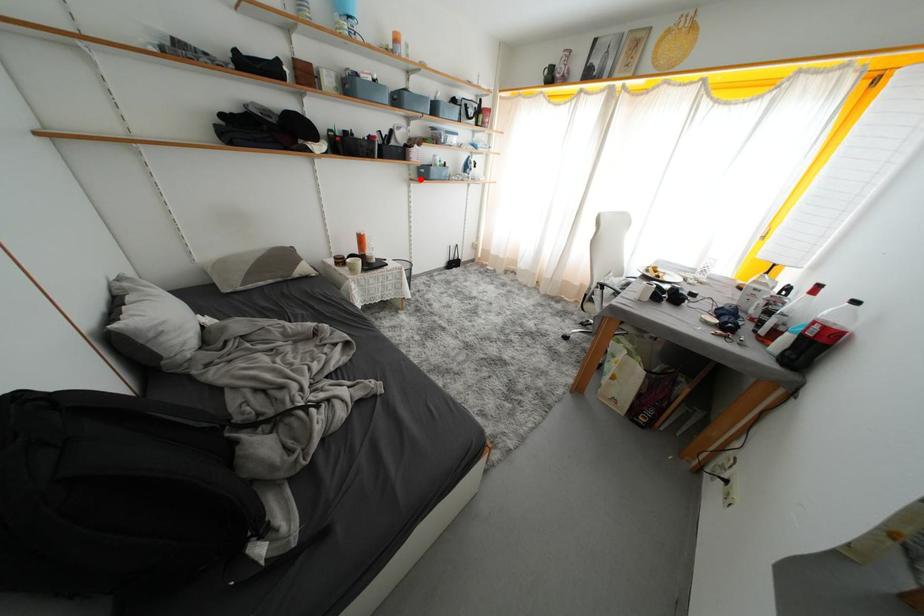
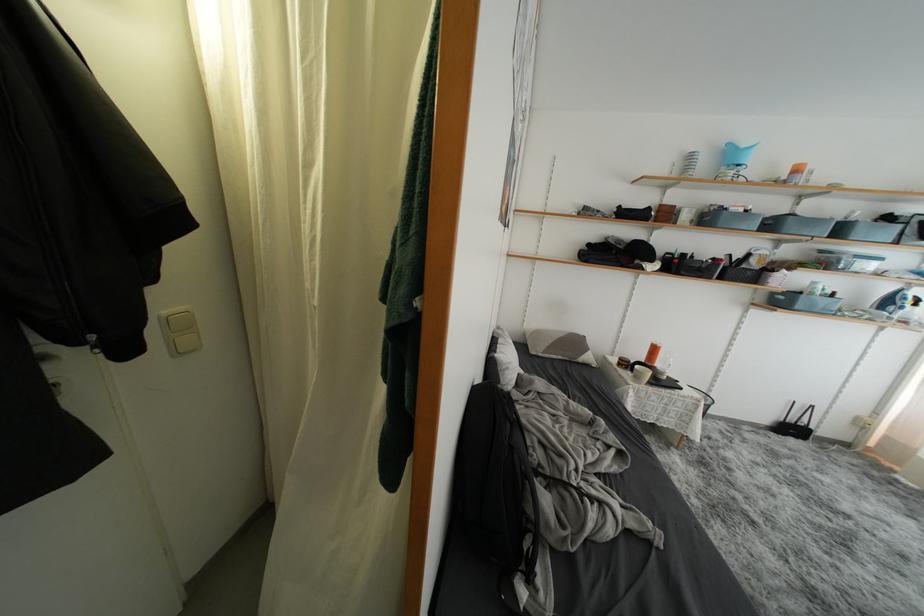
Question: I am providing you with two images of the same scene from different viewpoints. A red point is shown in image1. For the corresponding object point in image2, is it positioned nearer or farther from the camera?

Choices:
 (A) Nearer
 (B) Farther

Answer: (B)